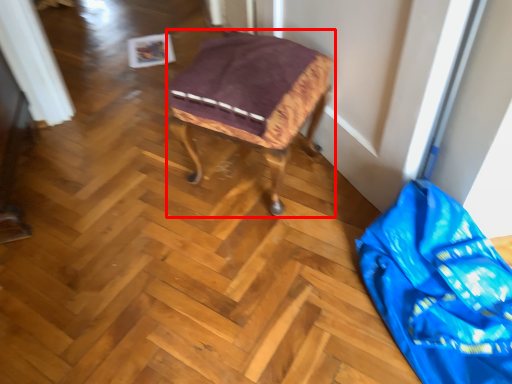
Question: From the image's perspective, considering the relative positions of furniture (annotated by the red box) and material in the image provided, where is furniture (annotated by the red box) located with respect to the staircase?

Choices:
 (A) above
 (B) below

Answer: (A)